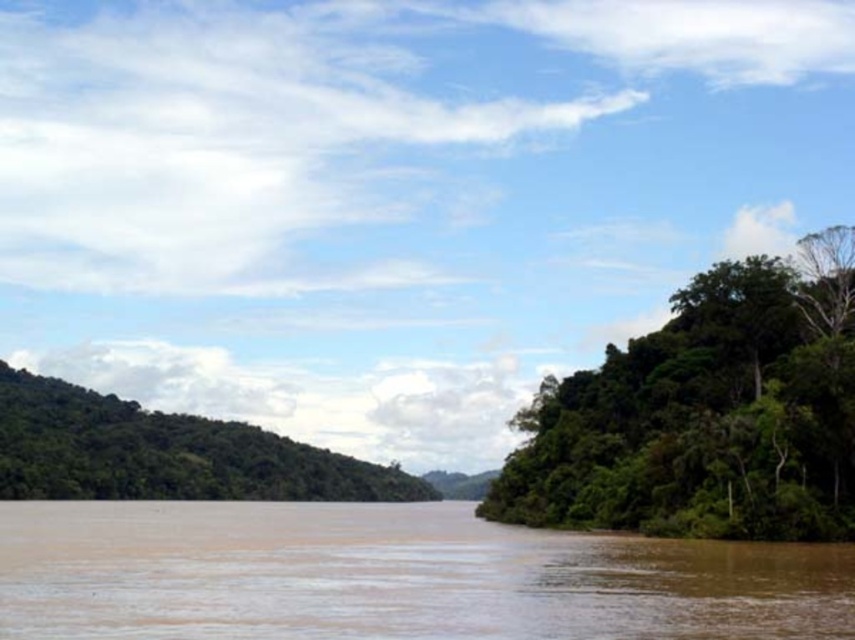
You are a hiker planning to cross the river and need to choose between two paths. One path is near the green leafy trees at right, and the other is near the green leafy forest at left. Which path would be higher in elevation?

The green leafy forest at left is taller than the green leafy trees at right, so the path near the green leafy forest at left is higher in elevation.